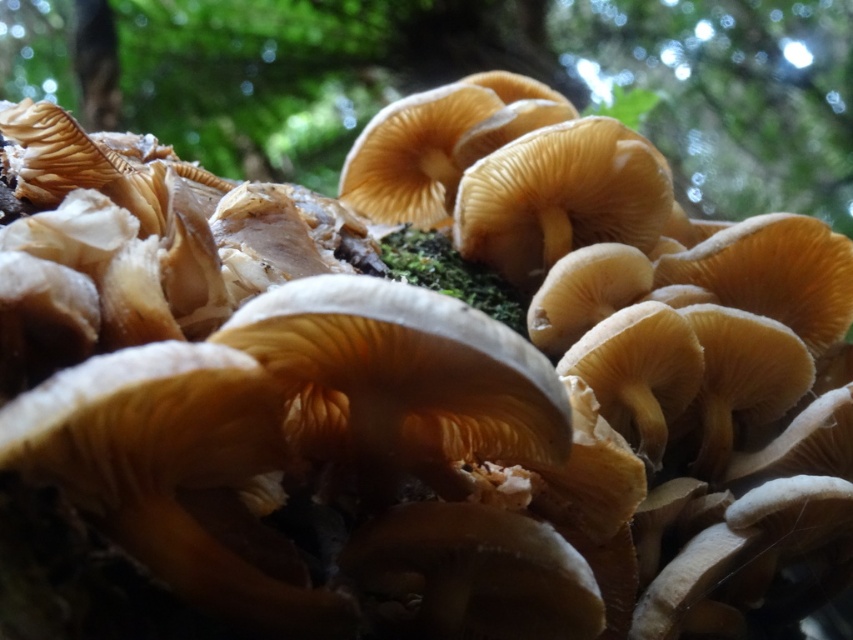
Question: Does matte brown mushrooms at center have a lesser width compared to brown rough tree trunk at upper left?

Choices:
 (A) yes
 (B) no

Answer: (B)

Question: Can you confirm if matte brown mushrooms at center is thinner than brown rough tree trunk at upper left?

Choices:
 (A) no
 (B) yes

Answer: (A)

Question: Which object appears farthest from the camera in this image?

Choices:
 (A) brown rough tree trunk at upper left
 (B) matte brown mushrooms at center

Answer: (A)

Question: Which of the following is the farthest from the observer?

Choices:
 (A) matte brown mushrooms at center
 (B) brown rough tree trunk at upper left

Answer: (B)

Question: Which point appears farthest from the camera in this image?

Choices:
 (A) (645, 104)
 (B) (111, 112)

Answer: (B)

Question: Does matte brown mushrooms at center appear on the left side of brown rough tree trunk at upper left?

Choices:
 (A) no
 (B) yes

Answer: (A)